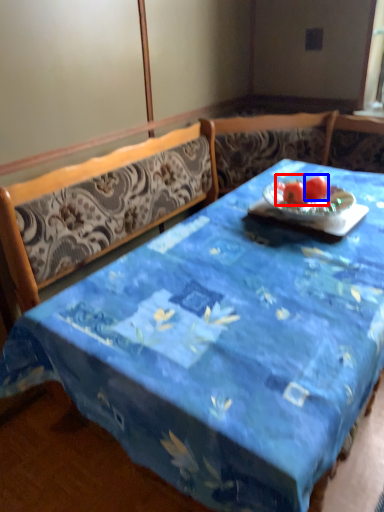
Question: Which of the following is the closest to the observer, fruit (highlighted by a red box) or tomato (highlighted by a blue box)?

Choices:
 (A) fruit
 (B) tomato

Answer: (A)